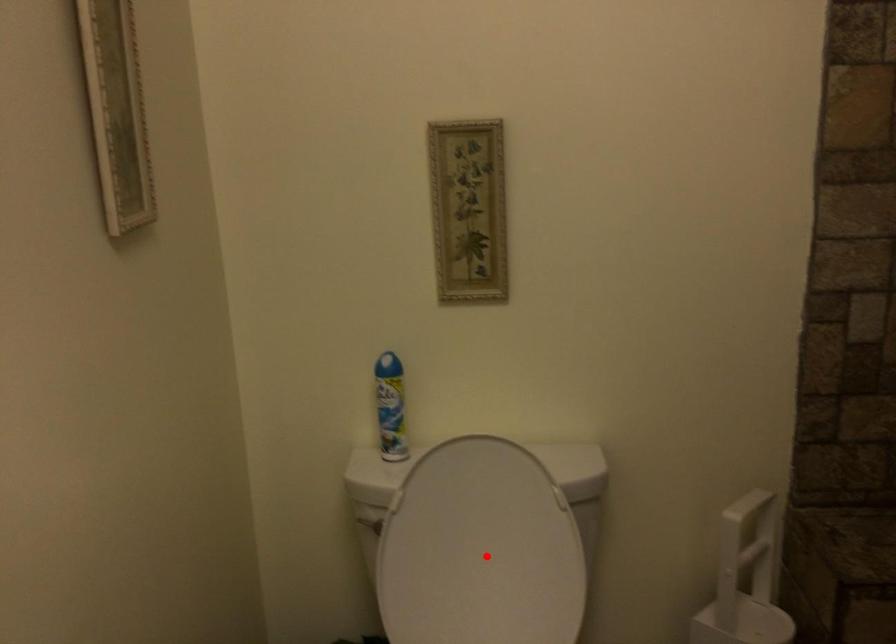
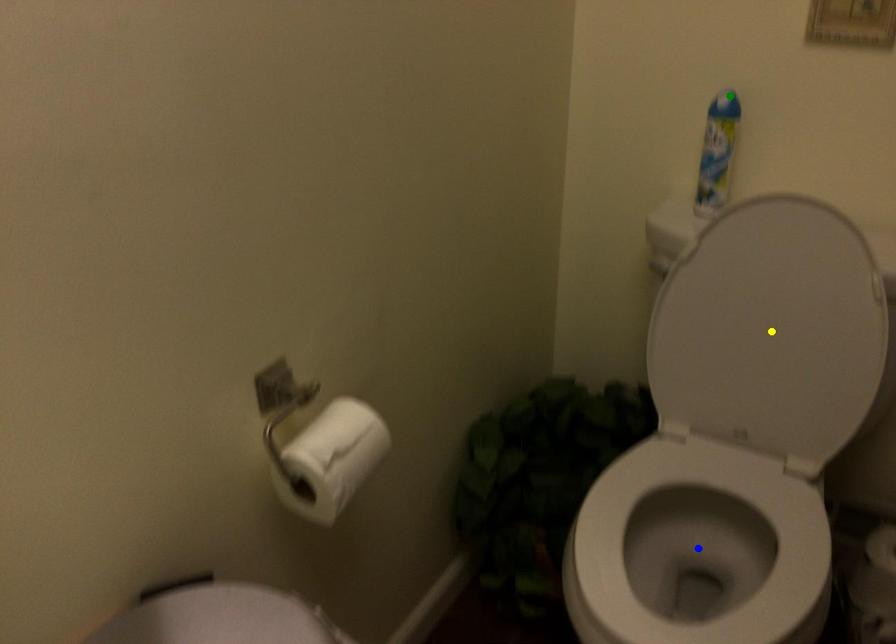
Question: I am providing you with two images of the same scene from different viewpoints. A red point is marked on the first image. You are given multiple points on the second image. Which mark in image 2 goes with the point in image 1?

Choices:
 (A) blue point
 (B) green point
 (C) yellow point

Answer: (C)